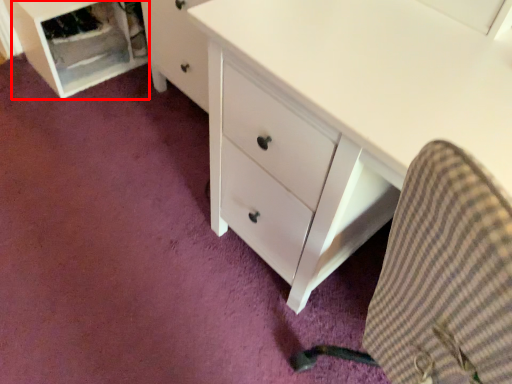
Question: From the image's perspective, where is file cabinet (annotated by the red box) located in relation to computer chair in the image?

Choices:
 (A) above
 (B) below

Answer: (A)